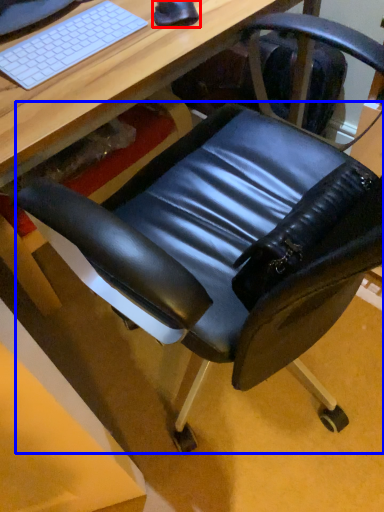
Question: Which point is further to the camera, mouse (highlighted by a red box) or swivel chair (highlighted by a blue box)?

Choices:
 (A) mouse
 (B) swivel chair

Answer: (A)